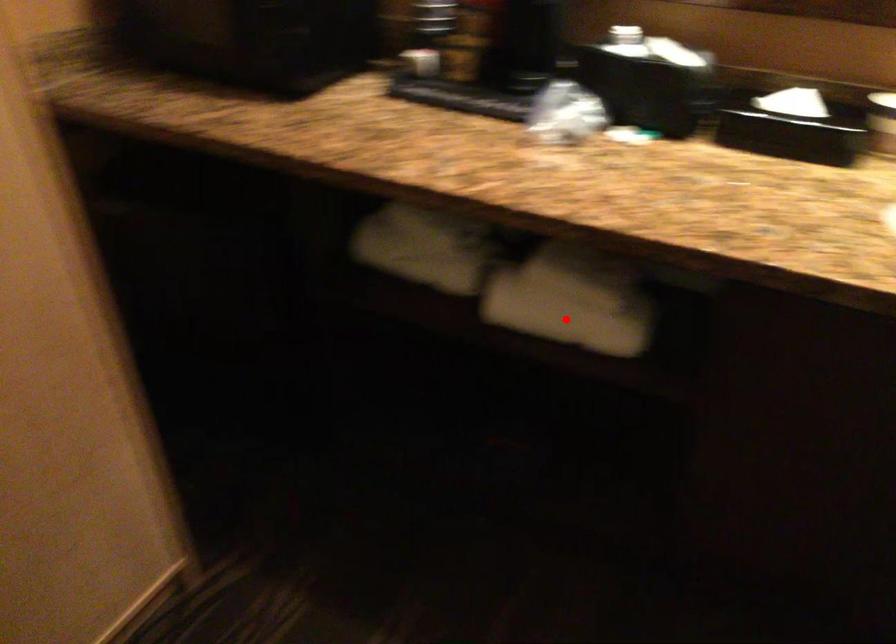
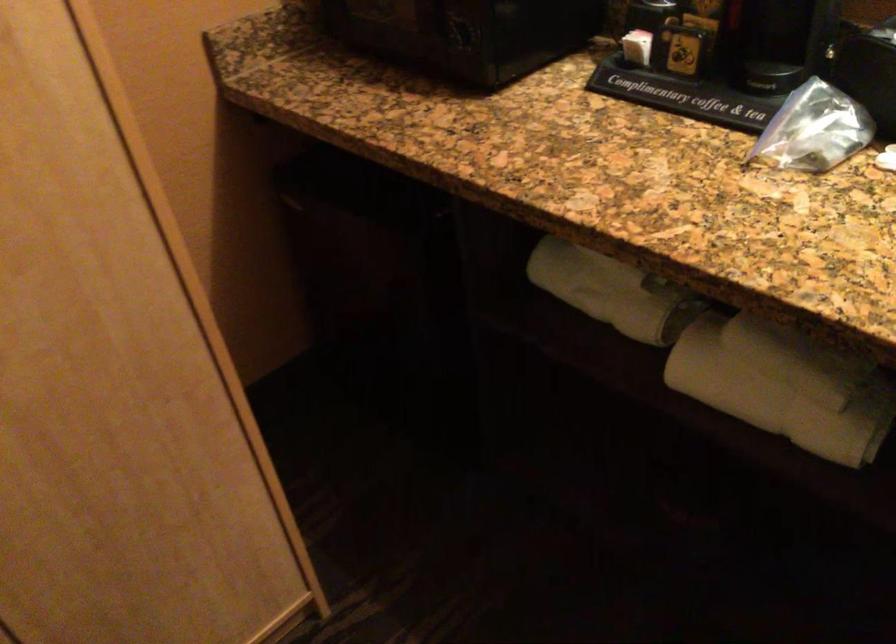
Question: I am providing you with two images of the same scene from different viewpoints. A red point is shown in image1. For the corresponding object point in image2, is it positioned nearer or farther from the camera?

Choices:
 (A) Nearer
 (B) Farther

Answer: (A)